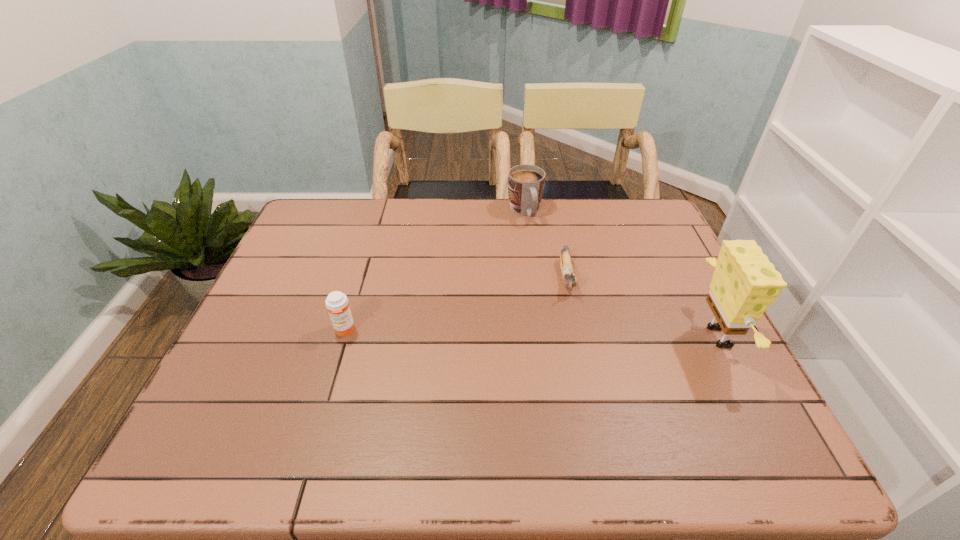
I want to click on free point between the medicine and the sponge, so click(534, 334).

I want to click on free area in between the second object from right to left and the leftmost object, so click(x=456, y=303).

You are a GUI agent. You are given a task and a screenshot of the screen. Output one action in this format:
    pyautogui.click(x=<x>, y=<y>)
    Task: Click on the unoccupied area between the shortest object and the mug
    The width and height of the screenshot is (960, 540).
    Given the screenshot: What is the action you would take?
    pyautogui.click(x=546, y=245)

This screenshot has height=540, width=960. I want to click on free space that is in between the sponge and the farthest object, so click(623, 274).

Select which object is the closest to the third object from left to right. Please provide its 2D coordinates. Your answer should be formatted as a tuple, i.e. [(x, y)], where the tuple contains the x and y coordinates of a point satisfying the conditions above.

[(526, 183)]

Identify the location of object that stands as the closest to the mug. (567, 272).

This screenshot has width=960, height=540. Identify the location of free space that satisfies the following two spatial constraints: 1. on the front side of the banana; 2. on the front-facing side of the sponge. (580, 337).

Locate an element on the screen. The width and height of the screenshot is (960, 540). vacant space that satisfies the following two spatial constraints: 1. on the front side of the tallest object; 2. on the front-facing side of the farthest object is located at coordinates (541, 337).

Where is `free space that satisfies the following two spatial constraints: 1. on the front side of the sponge; 2. on the front-facing side of the banana`? The height and width of the screenshot is (540, 960). free space that satisfies the following two spatial constraints: 1. on the front side of the sponge; 2. on the front-facing side of the banana is located at coordinates (580, 337).